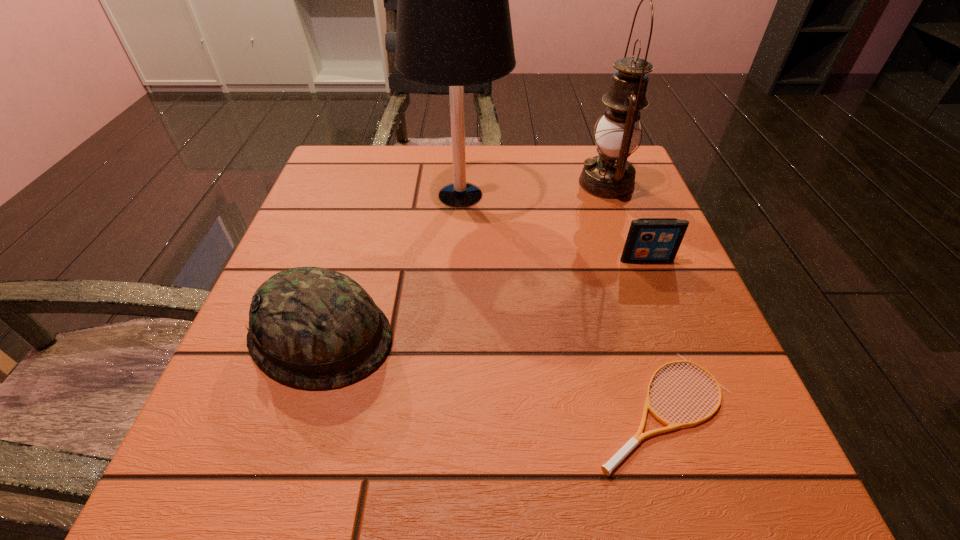
You are a GUI agent. You are given a task and a screenshot of the screen. Output one action in this format:
    pyautogui.click(x=<x>, y=<y>)
    Task: Click on the vacant region between the third nearest object and the table lamp
    
    Given the screenshot: What is the action you would take?
    pyautogui.click(x=553, y=227)

This screenshot has width=960, height=540. Find the location of `free spot between the table lamp and the oil lamp`. free spot between the table lamp and the oil lamp is located at coordinates coord(534,189).

Find the location of a particular element. This screenshot has width=960, height=540. blank region between the oil lamp and the table lamp is located at coordinates pyautogui.click(x=534, y=189).

Locate an element on the screen. free space between the tennis racket and the headwear is located at coordinates (492, 373).

Where is `free space that is in between the tennis racket and the second shortest object`? free space that is in between the tennis racket and the second shortest object is located at coordinates (655, 335).

Locate an element on the screen. The height and width of the screenshot is (540, 960). vacant space that's between the oil lamp and the third tallest object is located at coordinates (464, 260).

In order to click on blank region between the third nearest object and the tennis racket in this screenshot , I will do `click(655, 335)`.

Locate an element on the screen. object that is the fourth closest to the third tallest object is located at coordinates (609, 175).

Locate which object is the fourth closest to the oil lamp. Please provide its 2D coordinates. Your answer should be formatted as a tuple, i.e. [(x, y)], where the tuple contains the x and y coordinates of a point satisfying the conditions above.

[(312, 327)]

Where is `vacant area in the image that satisfies the following two spatial constraints: 1. on the back side of the oil lamp; 2. on the left side of the table lamp`? vacant area in the image that satisfies the following two spatial constraints: 1. on the back side of the oil lamp; 2. on the left side of the table lamp is located at coordinates (461, 183).